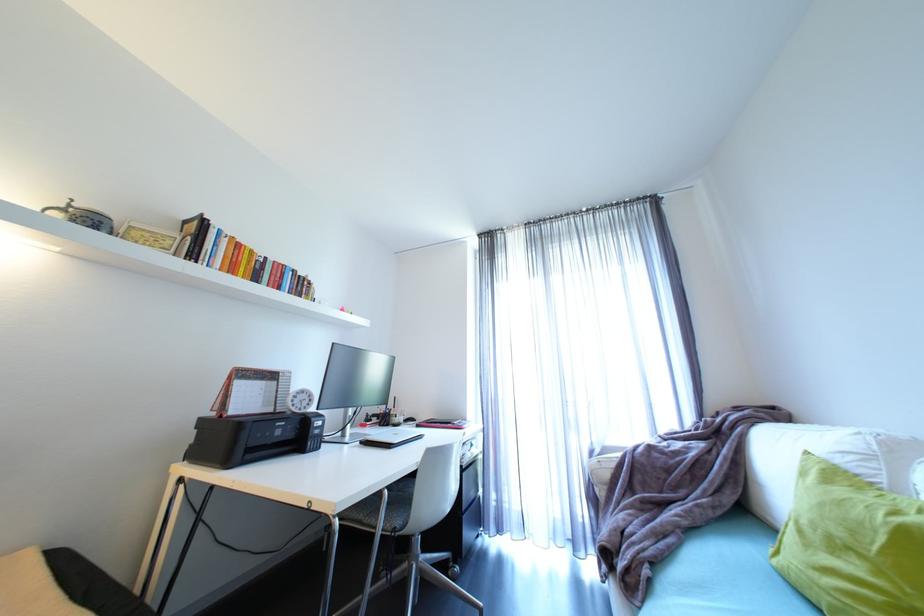
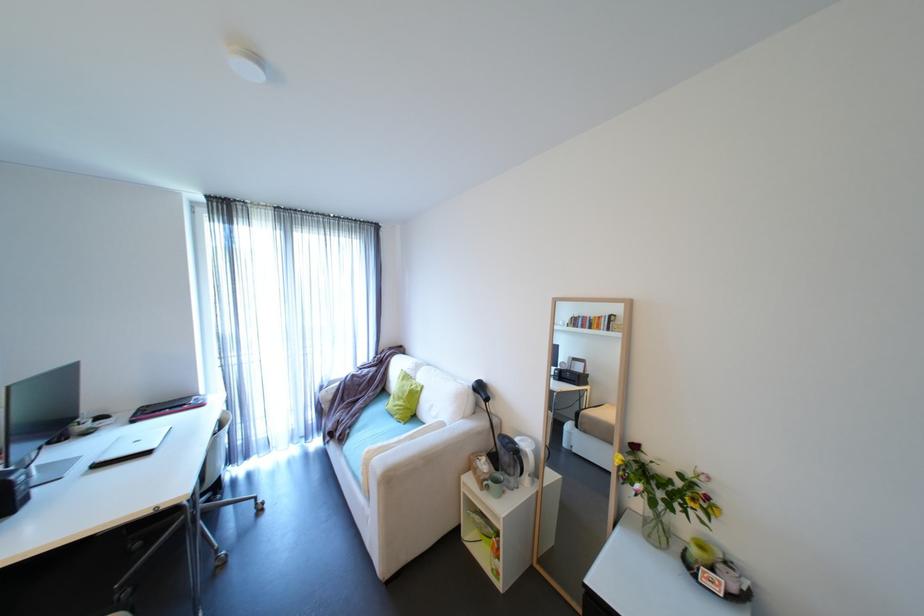
Find the pixel in the second image that matches pixel 636 581 in the first image.

(347, 438)